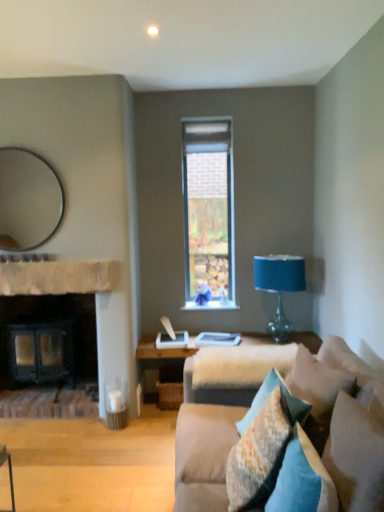
Question: From the image's perspective, is blue glass table lamp at right below textured beige pillow at lower right, marked as the 3th pillow in a front-to-back arrangement?

Choices:
 (A) yes
 (B) no

Answer: (B)

Question: Does blue glass table lamp at right appear on the right side of textured beige pillow at lower right, placed as the second pillow when sorted from back to front?

Choices:
 (A) yes
 (B) no

Answer: (A)

Question: Considering the relative sizes of blue glass table lamp at right and textured beige pillow at lower right, marked as the 3th pillow in a front-to-back arrangement, in the image provided, is blue glass table lamp at right taller than textured beige pillow at lower right, marked as the 3th pillow in a front-to-back arrangement,?

Choices:
 (A) yes
 (B) no

Answer: (A)

Question: Considering the relative sizes of blue glass table lamp at right and textured beige pillow at lower right, marked as the 3th pillow in a front-to-back arrangement, in the image provided, is blue glass table lamp at right smaller than textured beige pillow at lower right, marked as the 3th pillow in a front-to-back arrangement,?

Choices:
 (A) yes
 (B) no

Answer: (B)

Question: Can you confirm if blue glass table lamp at right is wider than textured beige pillow at lower right, placed as the second pillow when sorted from back to front?

Choices:
 (A) no
 (B) yes

Answer: (B)

Question: From a real-world perspective, is blue glass table lamp at right located higher than textured beige pillow at lower right, marked as the 3th pillow in a front-to-back arrangement?

Choices:
 (A) yes
 (B) no

Answer: (A)

Question: Considering the relative positions of brown stone fireplace at left and velvet beige couch at lower right in the image provided, is brown stone fireplace at left to the left of velvet beige couch at lower right from the viewer's perspective?

Choices:
 (A) yes
 (B) no

Answer: (A)

Question: From the image's perspective, does brown stone fireplace at left appear higher than velvet beige couch at lower right?

Choices:
 (A) yes
 (B) no

Answer: (A)

Question: Would you say brown stone fireplace at left is outside velvet beige couch at lower right?

Choices:
 (A) no
 (B) yes

Answer: (B)

Question: Does brown stone fireplace at left lie in front of velvet beige couch at lower right?

Choices:
 (A) no
 (B) yes

Answer: (A)

Question: Are brown stone fireplace at left and velvet beige couch at lower right far apart?

Choices:
 (A) no
 (B) yes

Answer: (B)

Question: Considering the relative sizes of brown stone fireplace at left and velvet beige couch at lower right in the image provided, is brown stone fireplace at left bigger than velvet beige couch at lower right?

Choices:
 (A) yes
 (B) no

Answer: (B)

Question: From the image's perspective, is matte silver mirror at upper left above dark wood fireplace at left?

Choices:
 (A) no
 (B) yes

Answer: (B)